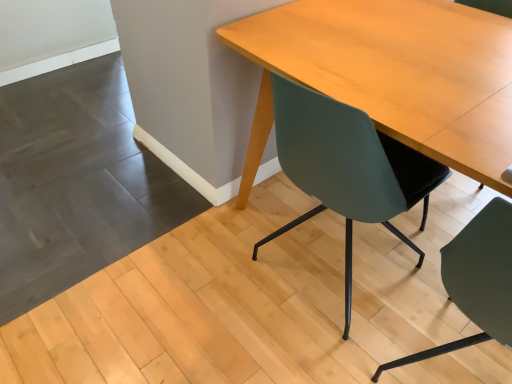
Question: Which direction should I rotate to look at teal matte chair at center, the 1th chair in the right-to-left sequence, — up or down?

Choices:
 (A) up
 (B) down

Answer: (B)

Question: Is light wood table at center oriented towards teal matte chair at center, the 1th chair in the right-to-left sequence?

Choices:
 (A) yes
 (B) no

Answer: (B)

Question: From the image's perspective, is light wood table at center over teal matte chair at center, acting as the second chair starting from the left?

Choices:
 (A) no
 (B) yes

Answer: (B)

Question: Does light wood table at center have a greater height compared to teal matte chair at center, the 1th chair in the right-to-left sequence?

Choices:
 (A) no
 (B) yes

Answer: (A)

Question: Can you see light wood table at center touching teal matte chair at center, acting as the second chair starting from the left?

Choices:
 (A) no
 (B) yes

Answer: (A)

Question: Does light wood table at center appear on the left side of teal matte chair at center, the 1th chair in the right-to-left sequence?

Choices:
 (A) yes
 (B) no

Answer: (A)

Question: Is light wood table at center to the right of teal matte chair at center, the 1th chair in the right-to-left sequence, from the viewer's perspective?

Choices:
 (A) yes
 (B) no

Answer: (B)

Question: Can you confirm if teal matte chair at center, the 1th chair in the right-to-left sequence, is positioned to the left of teal matte chair at center, the first chair from the left?

Choices:
 (A) yes
 (B) no

Answer: (B)

Question: Is teal matte chair at center, positioned as the 2th chair in right-to-left order, located within teal matte chair at center, acting as the second chair starting from the left?

Choices:
 (A) no
 (B) yes

Answer: (A)

Question: Considering the relative sizes of teal matte chair at center, the 1th chair in the right-to-left sequence, and teal matte chair at center, the first chair from the left, in the image provided, is teal matte chair at center, the 1th chair in the right-to-left sequence, thinner than teal matte chair at center, the first chair from the left,?

Choices:
 (A) yes
 (B) no

Answer: (B)

Question: Is teal matte chair at center, acting as the second chair starting from the left, bigger than teal matte chair at center, positioned as the 2th chair in right-to-left order?

Choices:
 (A) yes
 (B) no

Answer: (B)

Question: Is teal matte chair at center, the 1th chair in the right-to-left sequence, not inside teal matte chair at center, the first chair from the left?

Choices:
 (A) no
 (B) yes

Answer: (B)

Question: Is teal matte chair at center, acting as the second chair starting from the left, beside teal matte chair at center, the first chair from the left?

Choices:
 (A) yes
 (B) no

Answer: (B)

Question: Can you confirm if teal matte chair at center, acting as the second chair starting from the left, is wider than light wood table at center?

Choices:
 (A) yes
 (B) no

Answer: (B)